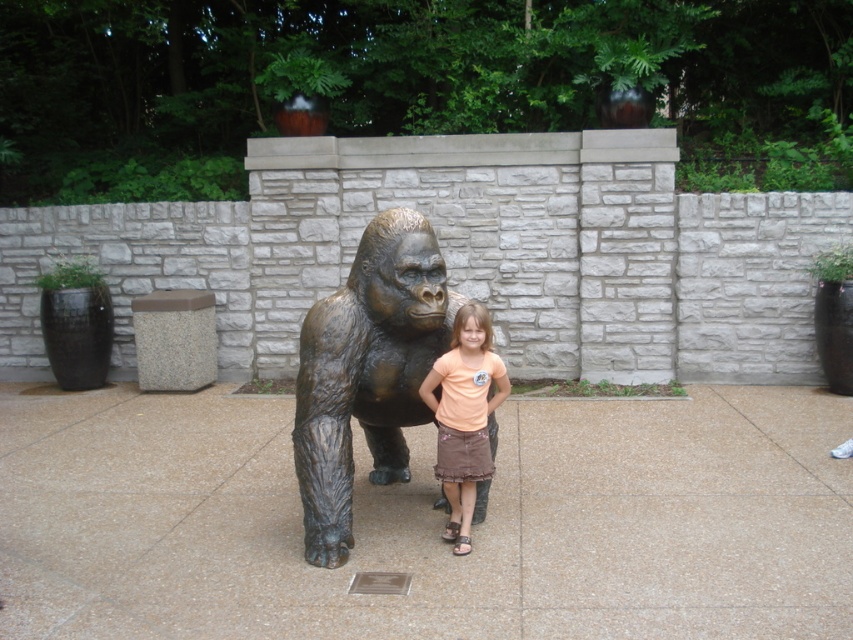
Question: Is bronze textured gorilla at center positioned in front of matte peach t-shirt at center?

Choices:
 (A) yes
 (B) no

Answer: (A)

Question: Which of the following is the farthest from the observer?

Choices:
 (A) matte peach t-shirt at center
 (B) bronze textured gorilla at center

Answer: (A)

Question: Does bronze textured gorilla at center have a greater width compared to matte peach t-shirt at center?

Choices:
 (A) yes
 (B) no

Answer: (A)

Question: Which point is farther from the camera taking this photo?

Choices:
 (A) (469, 317)
 (B) (402, 424)

Answer: (B)

Question: Can you confirm if bronze textured gorilla at center is wider than matte peach t-shirt at center?

Choices:
 (A) no
 (B) yes

Answer: (B)